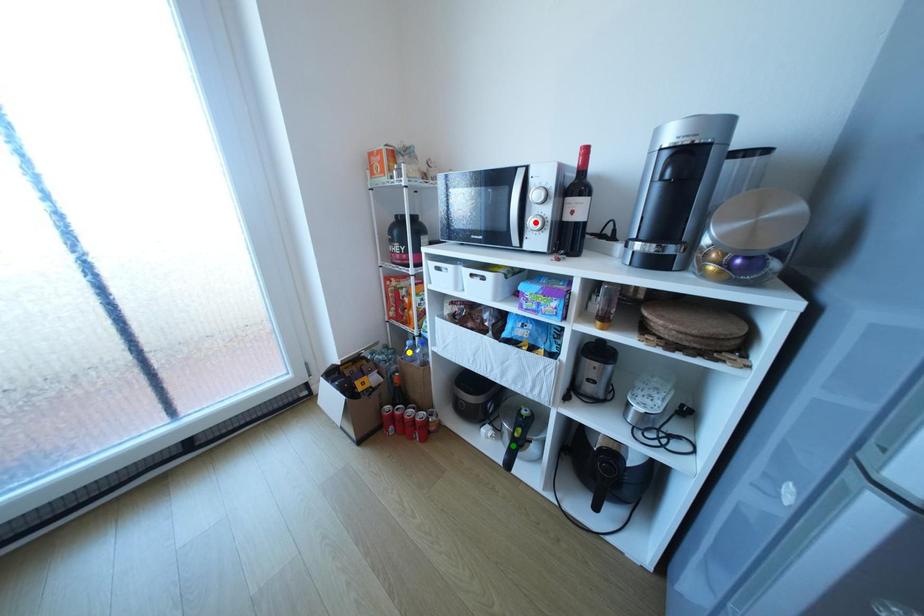
Order these from nearest to farthest:
yellow point, red point, green point

red point < green point < yellow point